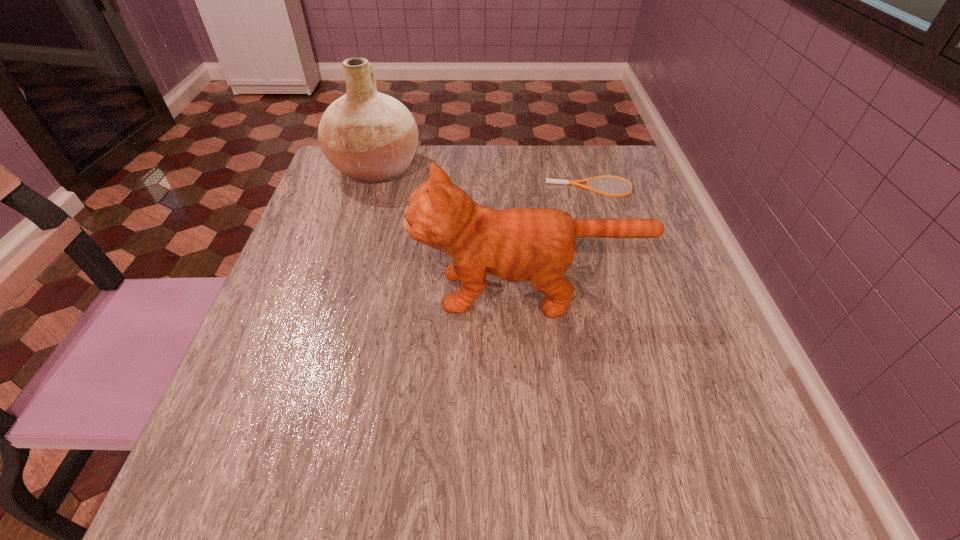
This screenshot has height=540, width=960. In order to click on pottery in this screenshot , I will do `click(371, 137)`.

You are a GUI agent. You are given a task and a screenshot of the screen. Output one action in this format:
    pyautogui.click(x=<x>, y=<y>)
    Task: Click on the nearest object
    The height and width of the screenshot is (540, 960).
    Given the screenshot: What is the action you would take?
    pyautogui.click(x=518, y=244)

Where is `the shortest object`? the shortest object is located at coordinates (554, 181).

The image size is (960, 540). Identify the location of free space located to pour from the handle of the leftmost object. (561, 168).

At what (x,y) coordinates should I click in order to perform the action: click on free point located 0.130m on the face of the nearest object. Please return your answer as a coordinate pair (x, y). Looking at the image, I should click on (347, 292).

In order to click on vacant space located on the face of the nearest object in this screenshot , I will do `click(362, 292)`.

The width and height of the screenshot is (960, 540). What are the coordinates of `free space located on the face of the nearest object` in the screenshot? It's located at (289, 292).

The width and height of the screenshot is (960, 540). What are the coordinates of `free location located on the front of the shortest object` in the screenshot? It's located at (603, 233).

You are a GUI agent. You are given a task and a screenshot of the screen. Output one action in this format:
    pyautogui.click(x=<x>, y=<y>)
    Task: Click on the pottery that is positioned at the far edge
    The width and height of the screenshot is (960, 540).
    Given the screenshot: What is the action you would take?
    pyautogui.click(x=371, y=137)

Where is `tennis racket that is at the far edge`? This screenshot has height=540, width=960. tennis racket that is at the far edge is located at coordinates (554, 181).